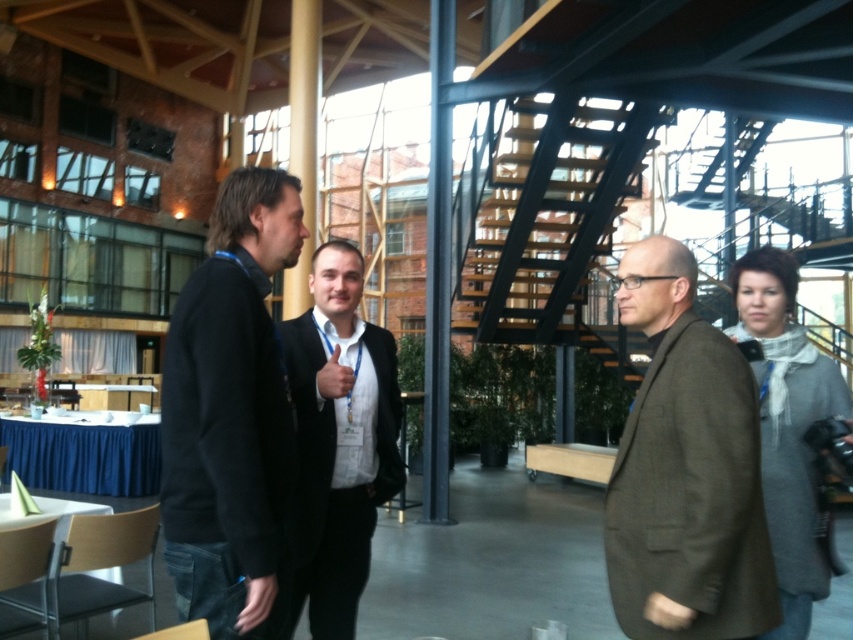
Question: Estimate the real-world distances between objects in this image. Which object is closer to the brown woolen jacket at center?

Choices:
 (A) dark gray sweater at center
 (B) black suit at center

Answer: (A)

Question: Is brown woolen jacket at center further to the viewer compared to black suit at center?

Choices:
 (A) yes
 (B) no

Answer: (B)

Question: Does dark gray sweater at center appear under black suit at center?

Choices:
 (A) yes
 (B) no

Answer: (B)

Question: Considering the real-world distances, which object is farthest from the brown woolen jacket at center?

Choices:
 (A) dark gray sweater at center
 (B) black suit at center

Answer: (B)

Question: Is dark gray sweater at center positioned before brown woolen jacket at center?

Choices:
 (A) no
 (B) yes

Answer: (B)

Question: Estimate the real-world distances between objects in this image. Which object is closer to the brown woolen jacket at center?

Choices:
 (A) black suit at center
 (B) dark gray sweater at center

Answer: (B)